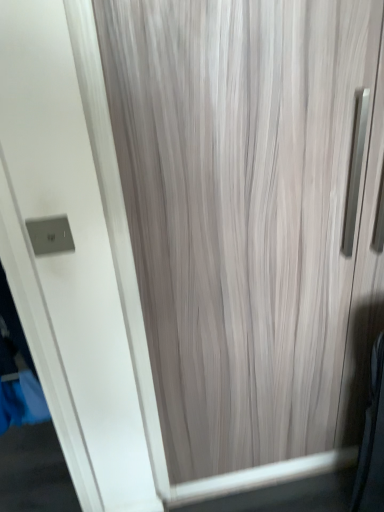
Question: From the image's perspective, would you say wooden door at center is positioned over satin silver switch at upper left?

Choices:
 (A) no
 (B) yes

Answer: (A)

Question: Is wooden door at center far from satin silver switch at upper left?

Choices:
 (A) yes
 (B) no

Answer: (B)

Question: Does wooden door at center turn towards satin silver switch at upper left?

Choices:
 (A) no
 (B) yes

Answer: (A)

Question: Is wooden door at center smaller than satin silver switch at upper left?

Choices:
 (A) no
 (B) yes

Answer: (A)

Question: Is wooden door at center bigger than satin silver switch at upper left?

Choices:
 (A) no
 (B) yes

Answer: (B)

Question: Is wooden door at center facing away from satin silver switch at upper left?

Choices:
 (A) yes
 (B) no

Answer: (B)

Question: Is satin silver switch at upper left positioned beyond the bounds of wooden door at center?

Choices:
 (A) yes
 (B) no

Answer: (A)

Question: Does satin silver switch at upper left appear on the left side of wooden door at center?

Choices:
 (A) no
 (B) yes

Answer: (B)

Question: Can you confirm if satin silver switch at upper left is bigger than wooden door at center?

Choices:
 (A) yes
 (B) no

Answer: (B)

Question: Is satin silver switch at upper left with wooden door at center?

Choices:
 (A) no
 (B) yes

Answer: (A)

Question: Is satin silver switch at upper left further to camera compared to wooden door at center?

Choices:
 (A) no
 (B) yes

Answer: (B)

Question: Is satin silver switch at upper left positioned far away from wooden door at center?

Choices:
 (A) yes
 (B) no

Answer: (B)

Question: Which is correct: satin silver switch at upper left is inside wooden door at center, or outside of it?

Choices:
 (A) outside
 (B) inside

Answer: (A)